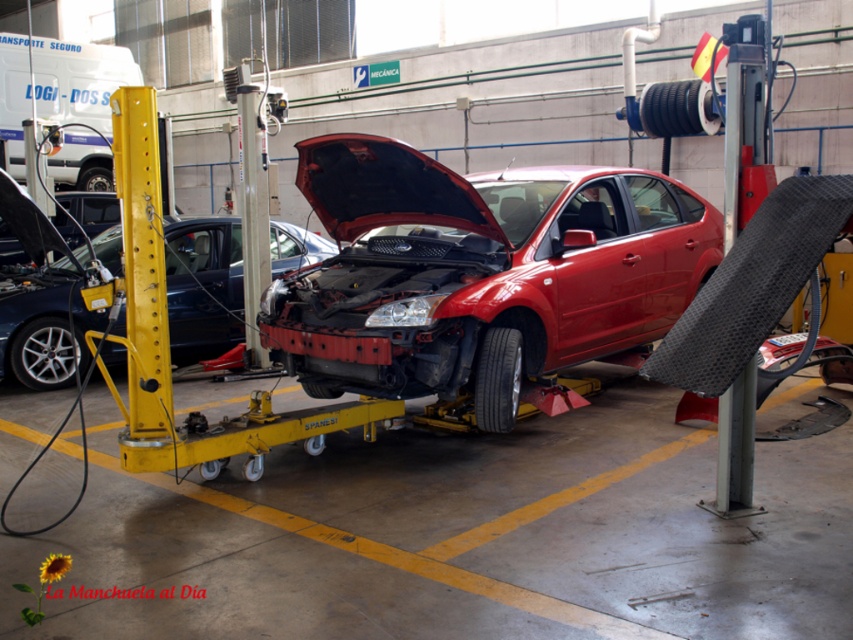
Question: Which object is closer to the camera taking this photo?

Choices:
 (A) shiny red car at center
 (B) shiny metallic car at center

Answer: (A)

Question: Does shiny red car at center appear over shiny metallic car at center?

Choices:
 (A) yes
 (B) no

Answer: (B)

Question: In this image, where is shiny red car at center located relative to shiny metallic car at center?

Choices:
 (A) below
 (B) above

Answer: (A)

Question: Among these points, which one is farthest from the camera?

Choices:
 (A) (625, 236)
 (B) (117, 230)

Answer: (B)

Question: Does shiny red car at center have a larger size compared to shiny metallic car at center?

Choices:
 (A) yes
 (B) no

Answer: (A)